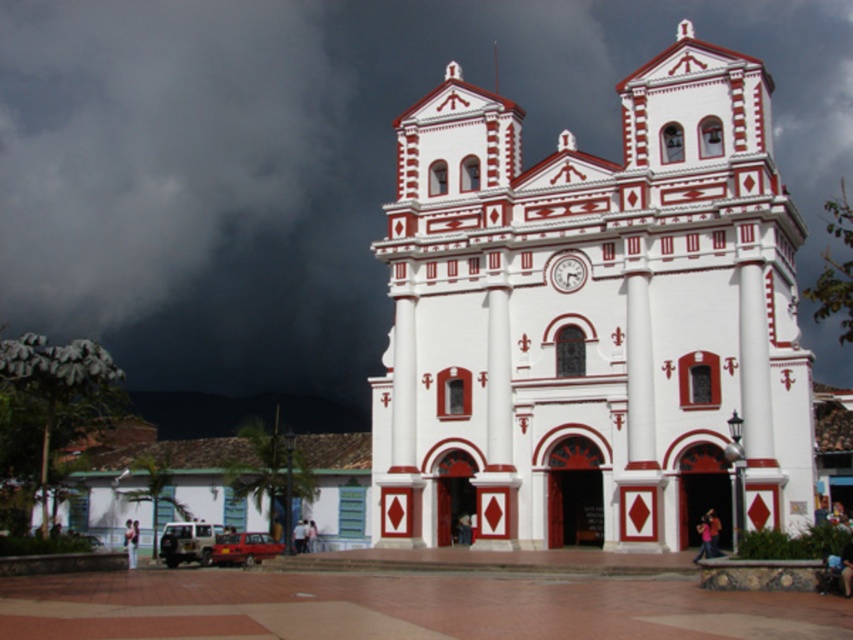
Can you confirm if white painted stone church at center is thinner than dark gray cloud at upper left?

Yes.

Is white painted stone church at center positioned behind dark gray cloud at upper left?

That is False.

Identify the location of white painted stone church at center. This screenshot has width=853, height=640. (592, 317).